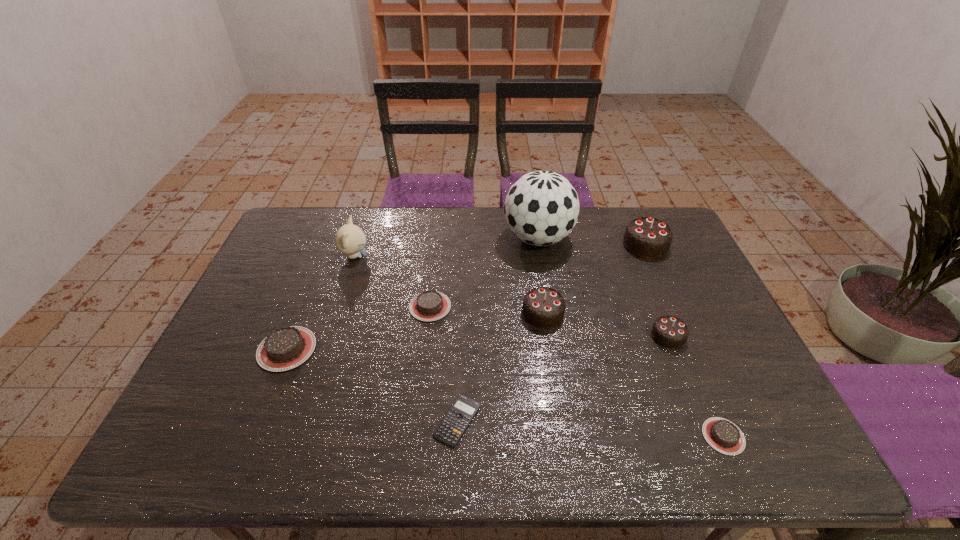
This screenshot has width=960, height=540. In order to click on black soccer ball in this screenshot , I will do `click(541, 208)`.

This screenshot has width=960, height=540. What are the coordinates of `the tallest object` in the screenshot? It's located at (541, 208).

What are the coordinates of `kitten` in the screenshot? It's located at (350, 239).

The image size is (960, 540). I want to click on the tallest chocolate cake, so click(647, 237).

In order to click on the biggest chocolate chocolate cake in this screenshot , I will do `click(647, 237)`.

Where is `the leftmost chocolate chocolate cake`? the leftmost chocolate chocolate cake is located at coordinates (543, 307).

Locate an element on the screen. The image size is (960, 540). the fifth shortest chocolate cake is located at coordinates (543, 307).

The width and height of the screenshot is (960, 540). I want to click on the smallest chocolate chocolate cake, so click(x=670, y=332).

At what (x,y) coordinates should I click in order to perform the action: click on the fourth shortest chocolate cake. Please return your answer as a coordinate pair (x, y). Looking at the image, I should click on (670, 332).

Where is `the biggest brown chocolate cake`? The height and width of the screenshot is (540, 960). the biggest brown chocolate cake is located at coordinates (285, 348).